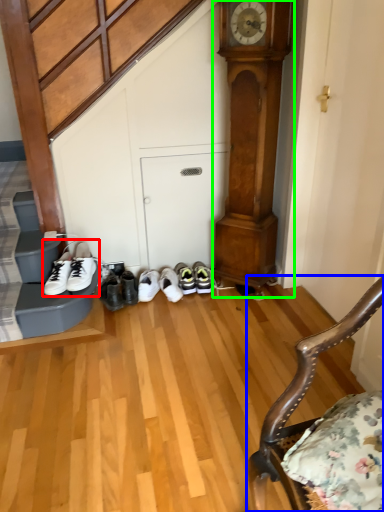
Question: Which is nearer to the footwear (highlighted by a red box)? chair (highlighted by a blue box) or clock (highlighted by a green box).

Choices:
 (A) chair
 (B) clock

Answer: (B)